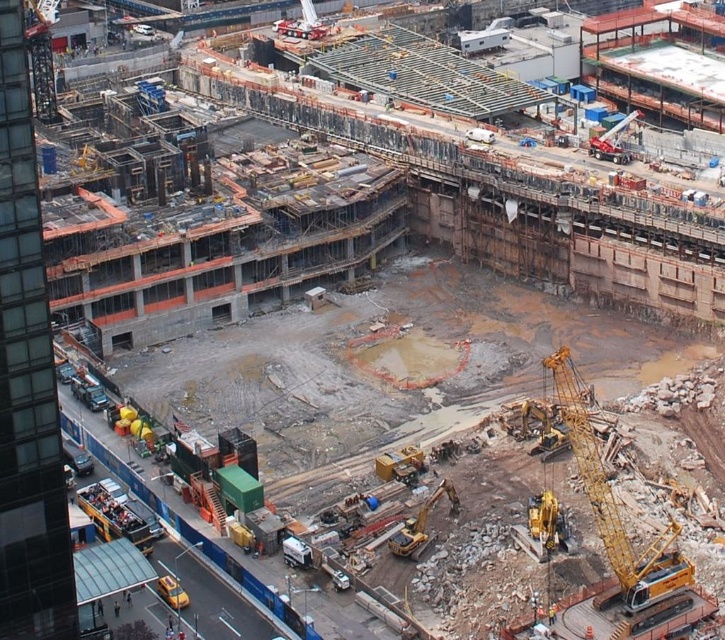
Question: Does yellow metallic crane at lower right appear on the right side of yellow metallic excavator at center?

Choices:
 (A) no
 (B) yes

Answer: (B)

Question: Which point appears farthest from the camera in this image?

Choices:
 (A) (455, 500)
 (B) (415, 448)

Answer: (B)

Question: Does yellow metallic excavator at lower right have a greater width compared to yellow metallic excavator at center?

Choices:
 (A) yes
 (B) no

Answer: (A)

Question: Considering the relative positions of yellow metallic excavator at lower right and yellow metallic excavator at center in the image provided, where is yellow metallic excavator at lower right located with respect to yellow metallic excavator at center?

Choices:
 (A) right
 (B) left

Answer: (A)

Question: Which of the following is the closest to the observer?

Choices:
 (A) (584, 468)
 (B) (435, 493)

Answer: (B)

Question: Which point appears closest to the camera in this image?

Choices:
 (A) (407, 464)
 (B) (602, 467)

Answer: (B)